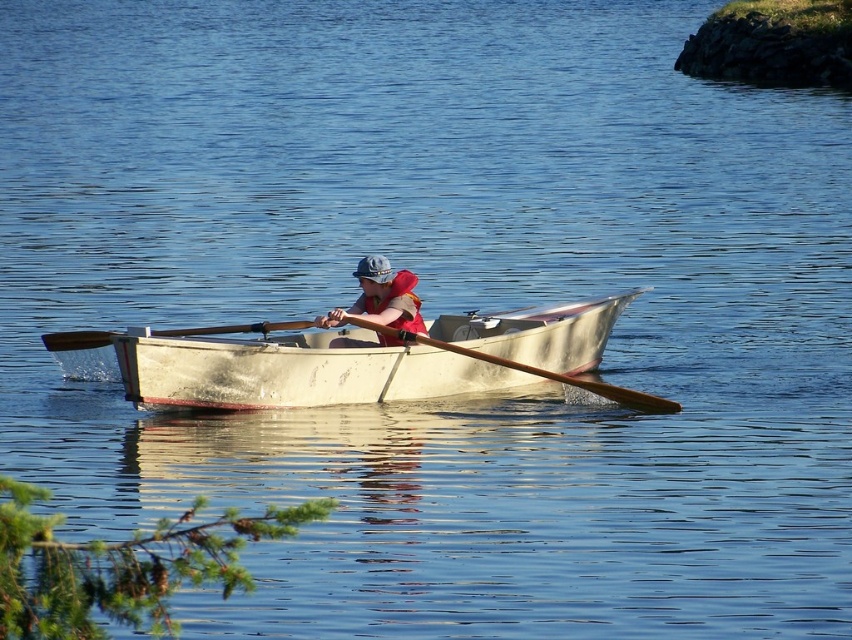
Which is below, wooden at center or brown wooden paddle at center?

wooden at center is lower down.

Between wooden at center and brown wooden paddle at center, which one appears on the left side from the viewer's perspective?

brown wooden paddle at center

Where is `wooden at center`? This screenshot has width=852, height=640. wooden at center is located at coordinates (525, 368).

Does white weathered boat at center lie in front of wooden at center?

Yes, it is.

Is point (273, 372) positioned in front of point (392, 333)?

Yes.

You are a GUI agent. You are given a task and a screenshot of the screen. Output one action in this format:
    pyautogui.click(x=<x>, y=<y>)
    Task: Click on the white weathered boat at center
    
    Given the screenshot: What is the action you would take?
    pyautogui.click(x=366, y=360)

Does white weathered boat at center have a greater height compared to matte red life vest at center?

Correct, white weathered boat at center is much taller as matte red life vest at center.

The image size is (852, 640). What do you see at coordinates (366, 360) in the screenshot? I see `white weathered boat at center` at bounding box center [366, 360].

Where is `white weathered boat at center`? white weathered boat at center is located at coordinates (366, 360).